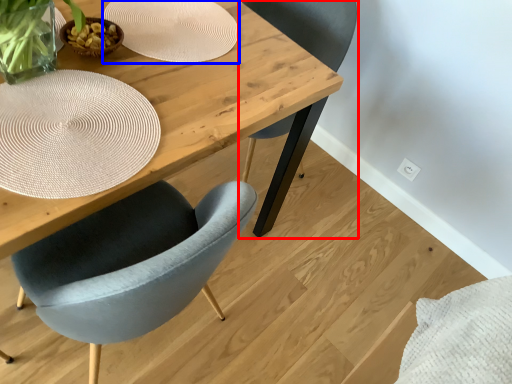
Question: Which of the following is the closest to the observer, chair (highlighted by a red box) or paper plate (highlighted by a blue box)?

Choices:
 (A) chair
 (B) paper plate

Answer: (B)